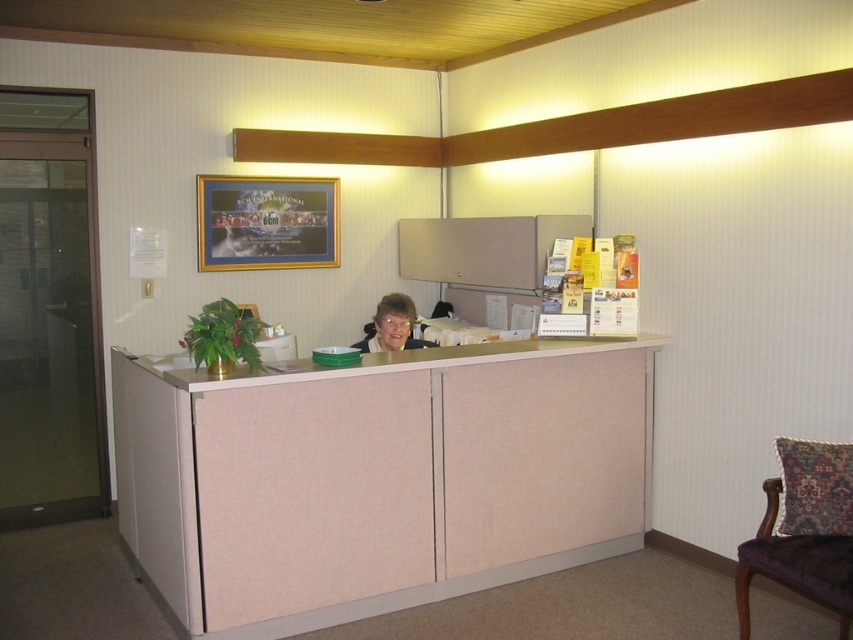
Question: Estimate the real-world distances between objects in this image. Which object is farther from the velvet purple chair at lower right?

Choices:
 (A) beige fabric desk at center
 (B) matte black hair at center

Answer: (B)

Question: Can you confirm if velvet purple chair at lower right is positioned to the right of matte black hair at center?

Choices:
 (A) yes
 (B) no

Answer: (A)

Question: Where is beige fabric desk at center located in relation to velvet purple chair at lower right in the image?

Choices:
 (A) above
 (B) below

Answer: (A)

Question: From the image, what is the correct spatial relationship of beige fabric desk at center in relation to velvet purple chair at lower right?

Choices:
 (A) right
 (B) left

Answer: (B)

Question: Considering the real-world distances, which object is closest to the velvet purple chair at lower right?

Choices:
 (A) matte black hair at center
 (B) beige fabric desk at center

Answer: (B)

Question: Which point is farther to the camera?

Choices:
 (A) beige fabric desk at center
 (B) matte black hair at center

Answer: (B)